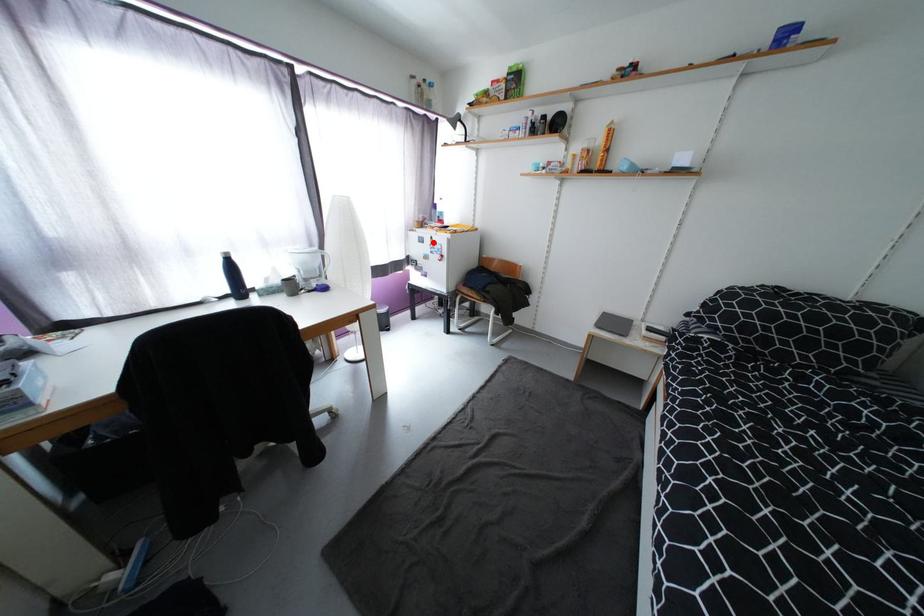
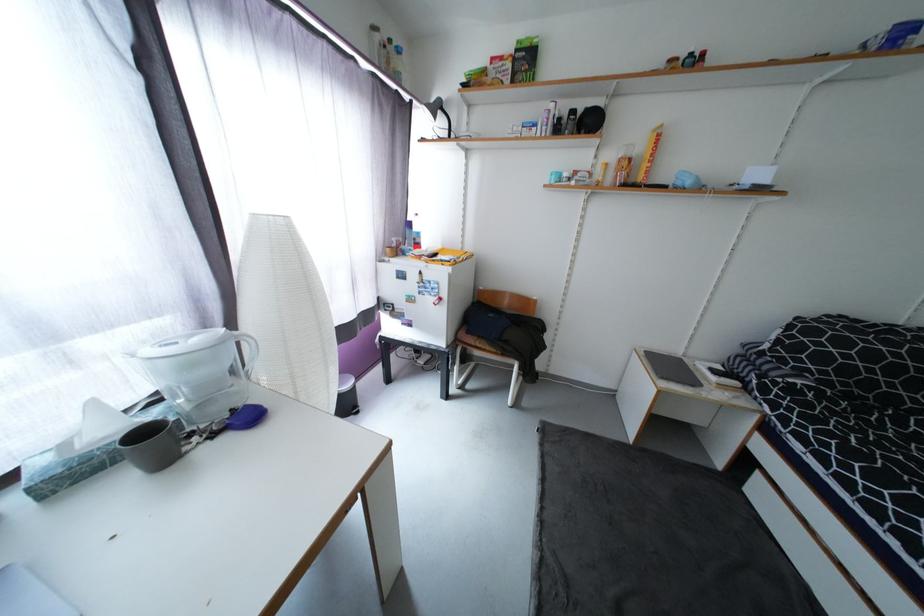
Find the pixel in the second image that matches the highlighted location in the first image.

(419, 278)